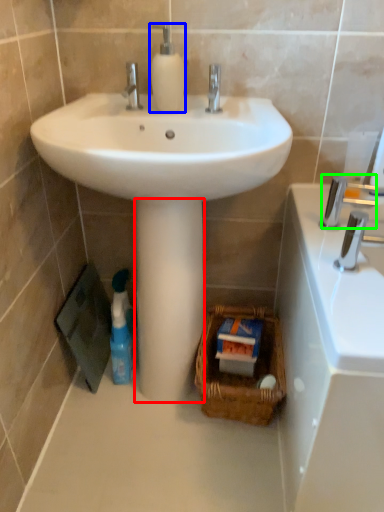
Question: Estimate the real-world distances between objects in this image. Which object is closer to pillar (highlighted by a red box), soap dispenser (highlighted by a blue box) or plumbing fixture (highlighted by a green box)?

Choices:
 (A) soap dispenser
 (B) plumbing fixture

Answer: (B)